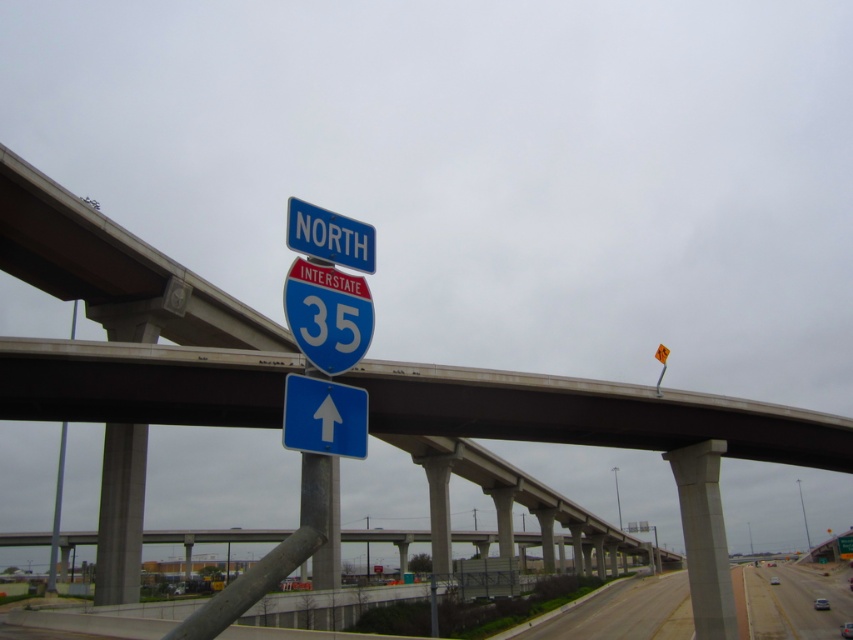
Who is shorter, gray concrete highway at lower right or blue plastic sign at upper center?

blue plastic sign at upper center is shorter.

In order to click on gray concrete highway at lower right in this screenshot , I will do `click(793, 604)`.

Locate an element on the screen. This screenshot has width=853, height=640. gray concrete highway at lower right is located at coordinates (793, 604).

Which of these two, gray concrete highway at lower right or metallic gray pole at left, stands taller?

Standing taller between the two is metallic gray pole at left.

Between point (780, 624) and point (68, 336), which one is positioned in front?

Point (780, 624)

I want to click on gray concrete highway at lower right, so click(793, 604).

Does gray concrete highway at lower right have a greater width compared to blue glossy arrow at center?

Yes, gray concrete highway at lower right is wider than blue glossy arrow at center.

Does gray concrete highway at lower right have a lesser width compared to blue glossy arrow at center?

Incorrect, gray concrete highway at lower right's width is not less than blue glossy arrow at center's.

I want to click on gray concrete highway at lower right, so click(793, 604).